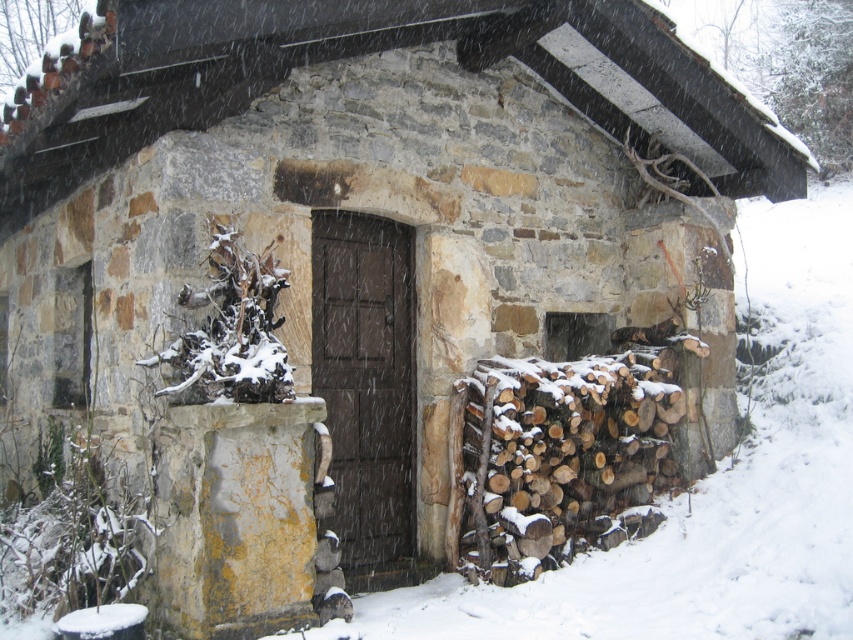
Based on the photo, is snow-covered woodpile at lower right bigger than dark wood door at center?

Indeed, snow-covered woodpile at lower right has a larger size compared to dark wood door at center.

Is point (474, 577) positioned after point (314, 358)?

No, (474, 577) is in front of (314, 358).

Where is `snow-covered woodpile at lower right`? This screenshot has width=853, height=640. snow-covered woodpile at lower right is located at coordinates (555, 458).